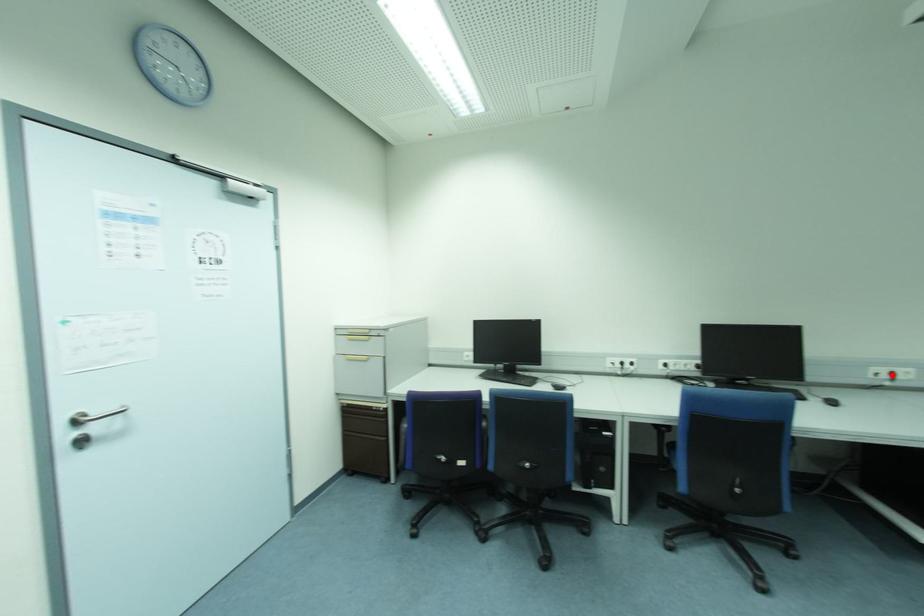
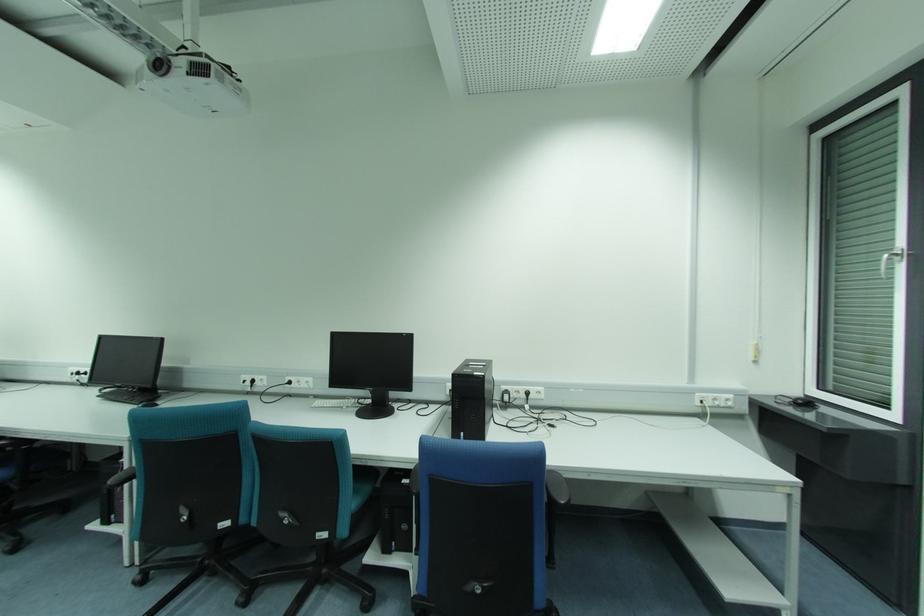
Question: I am providing you with two images of the same scene from different viewpoints. Given a red point in image1, look at the same physical point in image2. Is it:

Choices:
 (A) Closer to the viewpoint
 (B) Farther from the viewpoint

Answer: (B)